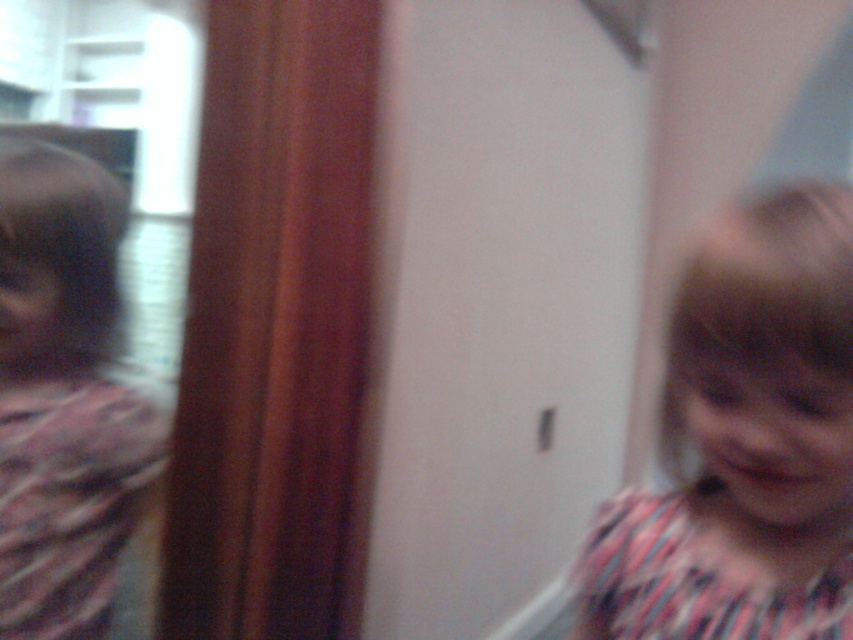
Does pink striped shirt at right have a smaller size compared to matte pink scarf at left?

Yes.

Does pink striped shirt at right appear on the right side of matte pink scarf at left?

Correct, you'll find pink striped shirt at right to the right of matte pink scarf at left.

At what (x,y) coordinates should I click in order to perform the action: click on pink striped shirt at right. Please return your answer as a coordinate pair (x, y). Looking at the image, I should click on (744, 444).